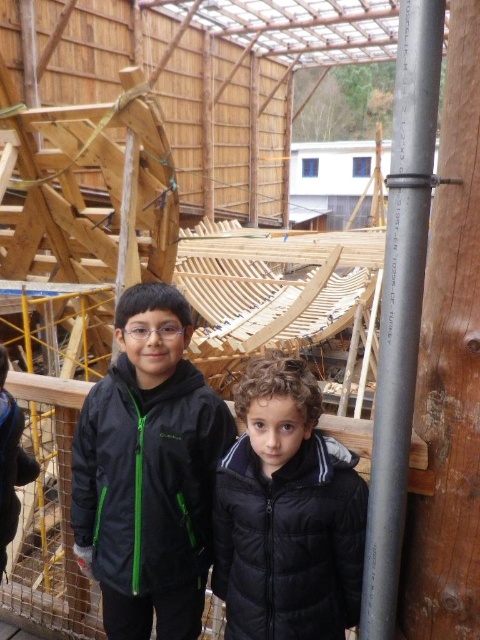
Question: Is the position of black matte jacket at center more distant than that of black matte jacket at lower left?

Choices:
 (A) yes
 (B) no

Answer: (B)

Question: Does black matte jacket at center appear on the right side of black matte jacket at lower left?

Choices:
 (A) no
 (B) yes

Answer: (B)

Question: Considering the real-world distances, which object is closest to the black matte jacket at lower left?

Choices:
 (A) black puffy jacket at center
 (B) black matte jacket at center

Answer: (B)

Question: Which object appears farthest from the camera in this image?

Choices:
 (A) black puffy jacket at center
 (B) black matte jacket at center

Answer: (B)

Question: Which point is closer to the camera?

Choices:
 (A) (244, 576)
 (B) (139, 573)
 (C) (3, 547)
 (D) (381, 442)

Answer: (D)

Question: Does black matte jacket at center lie in front of gray metallic pole at right?

Choices:
 (A) yes
 (B) no

Answer: (B)